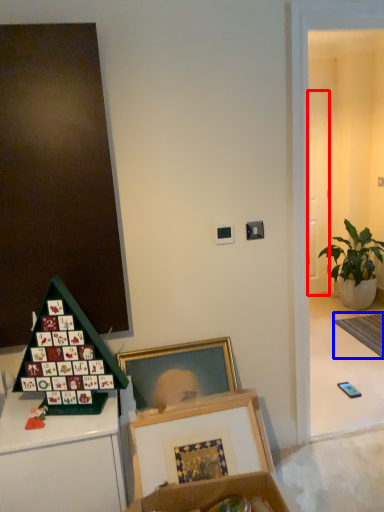
Question: Which object is closer to the camera taking this photo, door (highlighted by a red box) or mat (highlighted by a blue box)?

Choices:
 (A) door
 (B) mat

Answer: (B)